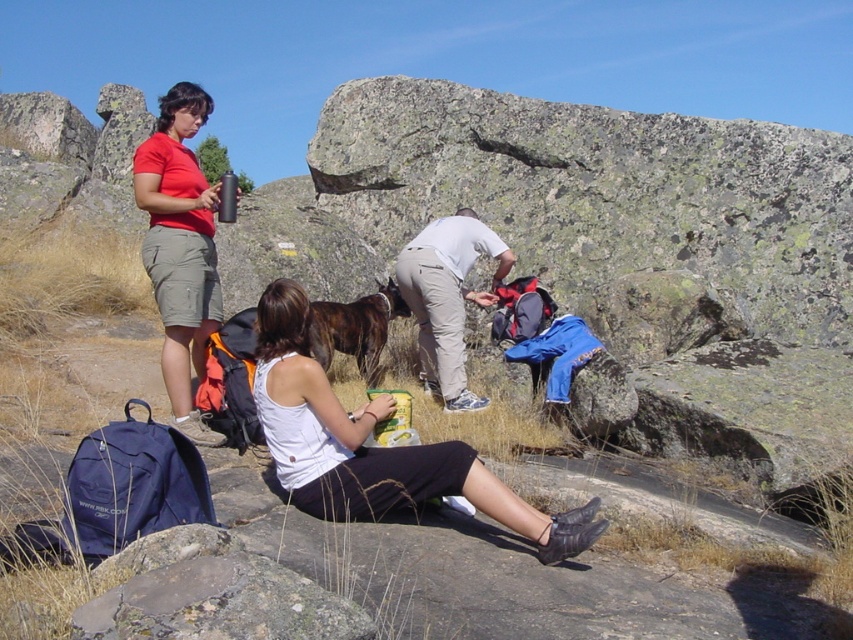
Is white fabric tank top at center bigger than matte red shirt at left?

Actually, white fabric tank top at center might be smaller than matte red shirt at left.

Is white fabric tank top at center smaller than matte red shirt at left?

Yes.

What do you see at coordinates (374, 449) in the screenshot? This screenshot has height=640, width=853. I see `white fabric tank top at center` at bounding box center [374, 449].

The width and height of the screenshot is (853, 640). In order to click on white fabric tank top at center in this screenshot , I will do `click(374, 449)`.

Is matte red shirt at left further to camera compared to white matte shirt at center?

No, matte red shirt at left is in front of white matte shirt at center.

Can you confirm if matte red shirt at left is positioned to the right of white matte shirt at center?

In fact, matte red shirt at left is to the left of white matte shirt at center.

Does point (167, 129) lie behind point (451, 333)?

No, it is not.

This screenshot has height=640, width=853. Identify the location of matte red shirt at left. (180, 248).

Is white fabric tank top at center smaller than white matte shirt at center?

No.

In the scene shown: Is white fabric tank top at center wider than white matte shirt at center?

Yes.

Which is behind, point (299, 333) or point (436, 262)?

The point (436, 262) is behind.

At what (x,y) coordinates should I click in order to perform the action: click on white fabric tank top at center. Please return your answer as a coordinate pair (x, y). The width and height of the screenshot is (853, 640). Looking at the image, I should click on (374, 449).